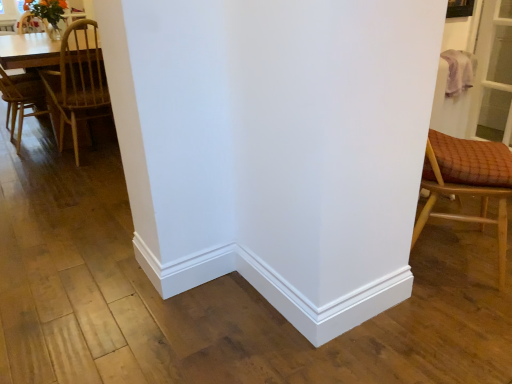
I want to click on vacant space in front of wooden checkered cushion at right, arranged as the second chair when viewed from the back, so click(x=457, y=319).